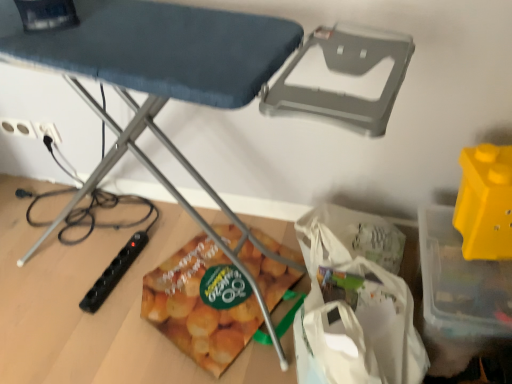
You are a GUI agent. You are given a task and a screenshot of the screen. Output one action in this format:
    pyautogui.click(x=<x>, y=<y>)
    Task: Click on the free spot to the right of black plastic power strip at lower left, positioned as the first toy in back-to-front order
    This screenshot has width=512, height=384.
    Given the screenshot: What is the action you would take?
    pyautogui.click(x=169, y=268)